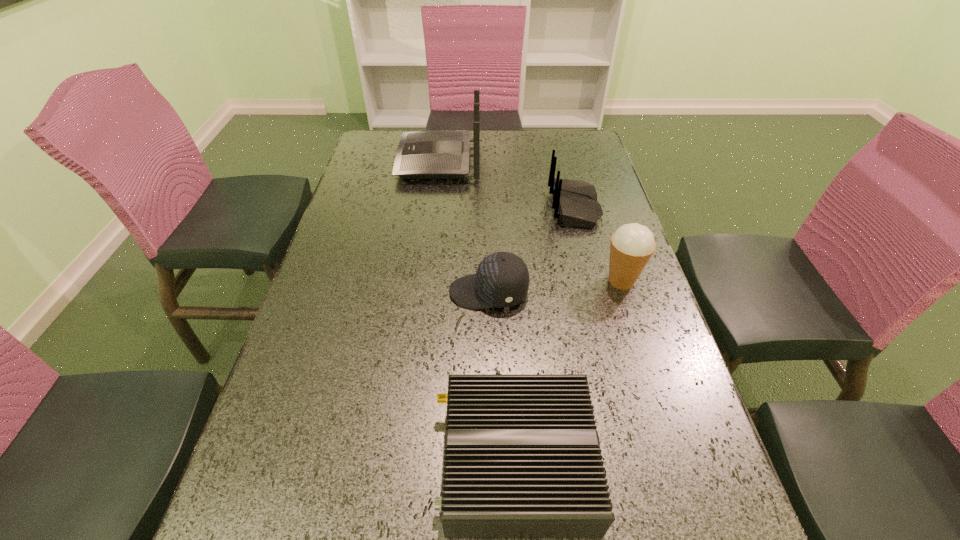
This screenshot has height=540, width=960. Identify the location of free space located on the back of the icecream. (600, 214).

Where is `vacant area situated on the back of the second farthest object`? The height and width of the screenshot is (540, 960). vacant area situated on the back of the second farthest object is located at coordinates (420, 207).

Identify the location of free space located 0.240m on the back of the second farthest object. This screenshot has width=960, height=540. (468, 207).

Where is `blank area located 0.070m on the back of the second farthest object`? The image size is (960, 540). blank area located 0.070m on the back of the second farthest object is located at coordinates point(526,207).

In order to click on vacant space positioned at the front of the baseball cap where the brim is located in this screenshot , I will do `click(349, 292)`.

This screenshot has width=960, height=540. I want to click on free spot located at the front of the baseball cap where the brim is located, so click(x=366, y=292).

The width and height of the screenshot is (960, 540). I want to click on vacant space located at the front of the baseball cap where the brim is located, so click(x=349, y=292).

The width and height of the screenshot is (960, 540). I want to click on free location located 0.280m on the back panel of the nearest router, so click(276, 461).

This screenshot has height=540, width=960. I want to click on free spot located on the back panel of the nearest router, so click(x=252, y=461).

Find the location of a particular element. The height and width of the screenshot is (540, 960). free space located 0.270m on the back panel of the nearest router is located at coordinates (281, 461).